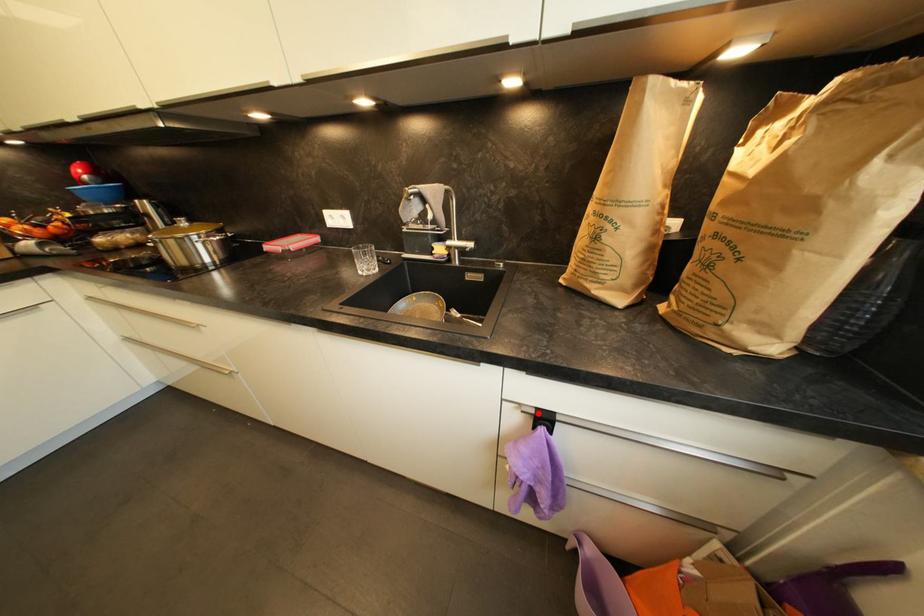
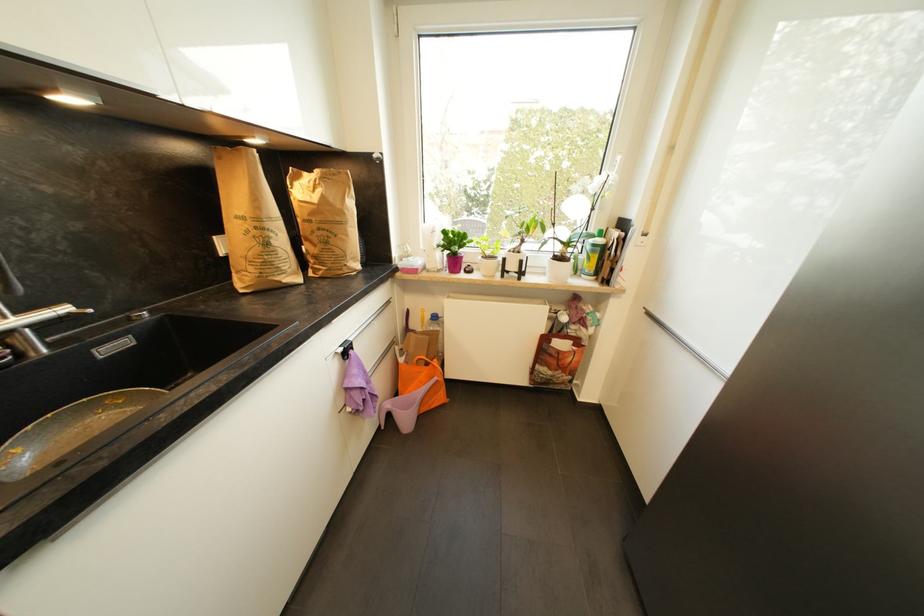
The point at the highlighted location is marked in the first image. Where is the corresponding point in the second image?

(346, 351)